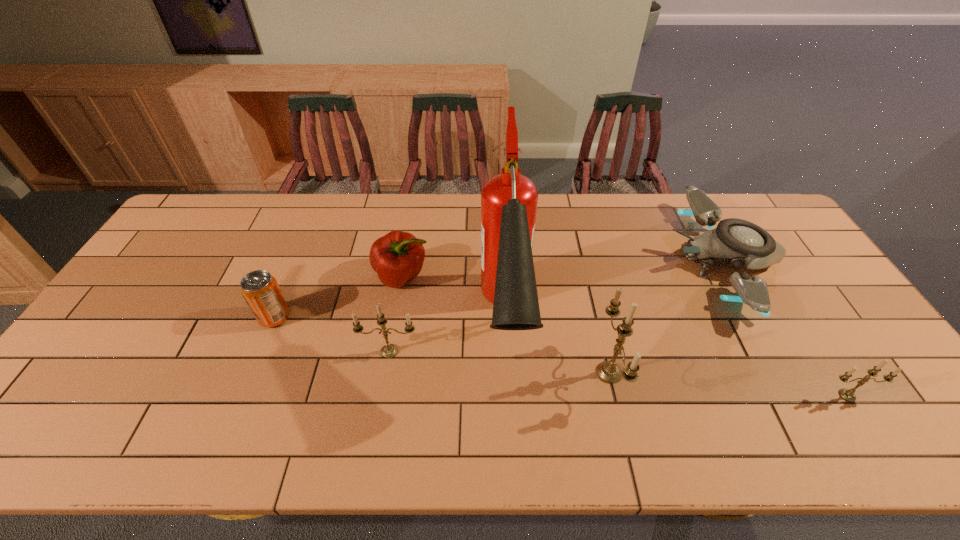
Identify the location of free area in between the second candle from right to left and the drone. (666, 316).

The width and height of the screenshot is (960, 540). I want to click on vacant space in between the second tallest object and the leftmost object, so click(x=442, y=345).

Where is `free point between the drone and the third tallest object`? free point between the drone and the third tallest object is located at coordinates (557, 306).

The height and width of the screenshot is (540, 960). I want to click on vacant space that's between the second shortest candle and the soda can, so click(332, 334).

Identify the location of object that is the fourth closest one to the fifth shortest object. (609, 372).

Identify which object is located as the third nearest to the soda can. Please provide its 2D coordinates. Your answer should be formatted as a tuple, i.e. [(x, y)], where the tuple contains the x and y coordinates of a point satisfying the conditions above.

[(509, 200)]

The image size is (960, 540). Identify the location of candle that can be found as the third closest to the soda can. (848, 395).

This screenshot has height=540, width=960. I want to click on candle that stands as the third closest to the bell pepper, so click(x=848, y=395).

This screenshot has width=960, height=540. In order to click on free region that satisfies the following two spatial constraints: 1. on the front-facing side of the drone; 2. on the back side of the rightmost candle in this screenshot , I will do `click(798, 395)`.

You are a GUI agent. You are given a task and a screenshot of the screen. Output one action in this format:
    pyautogui.click(x=<x>, y=<y>)
    Task: Click on the free location that satisfies the following two spatial constraints: 1. on the front-facing side of the shortest object; 2. on the back side of the shortest candle
    
    Given the screenshot: What is the action you would take?
    pyautogui.click(x=798, y=395)